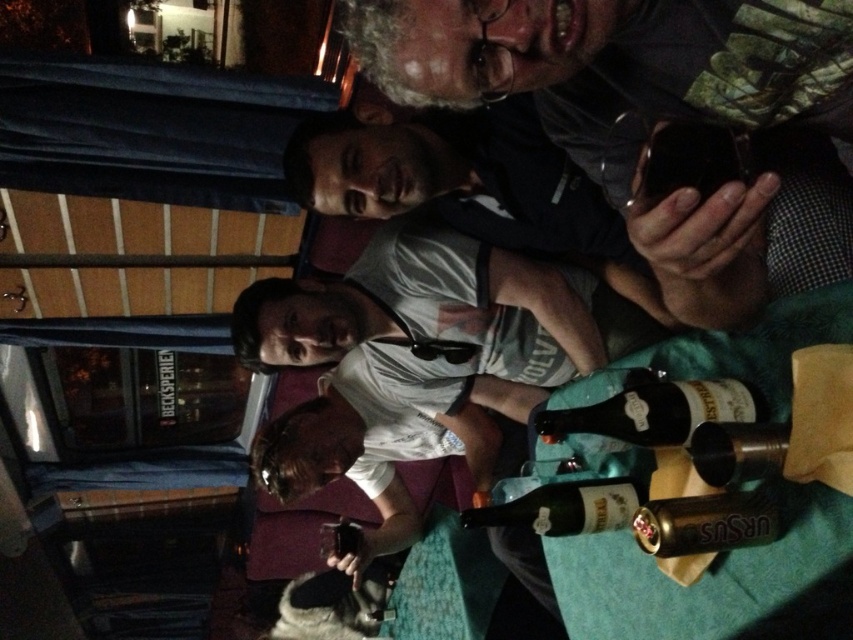
Question: Is translucent glass bottle at center positioned behind silver metallic can at lower right?

Choices:
 (A) no
 (B) yes

Answer: (B)

Question: Estimate the real-world distances between objects in this image. Which object is farther from the translucent glass bottle at lower center?

Choices:
 (A) silver metallic can at lower right
 (B) metallic silver bottle at center

Answer: (B)

Question: Where is silver metallic can at lower right located in relation to metallic silver bottle at center in the image?

Choices:
 (A) above
 (B) below

Answer: (B)

Question: Which object is farther from the camera taking this photo?

Choices:
 (A) matte black phone at upper center
 (B) silver metallic can at lower right
 (C) translucent glass bottle at center
 (D) metallic silver bottle at center

Answer: (C)

Question: Is translucent glass bottle at lower center below metallic silver bottle at center?

Choices:
 (A) no
 (B) yes

Answer: (B)

Question: Which object appears farthest from the camera in this image?

Choices:
 (A) translucent glass bottle at center
 (B) metallic silver bottle at center
 (C) translucent glass bottle at lower center

Answer: (C)